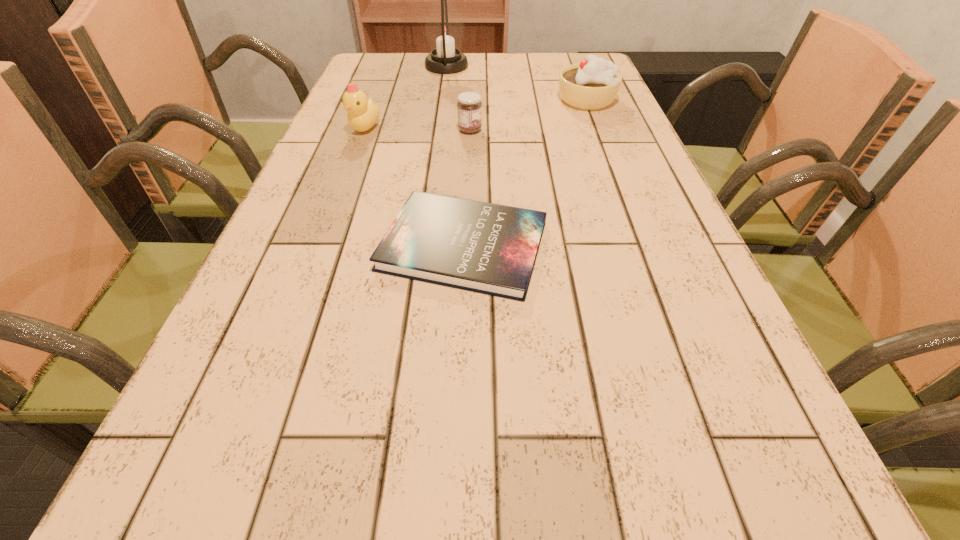
Locate an element on the screen. Image resolution: width=960 pixels, height=540 pixels. vacant region that satisfies the following two spatial constraints: 1. on the back side of the shortest object; 2. on the right side of the rightmost object is located at coordinates (469, 100).

Where is `free region that satisfies the following two spatial constraints: 1. on the front side of the rightmost object; 2. on the front label of the fourth tallest object`? This screenshot has height=540, width=960. free region that satisfies the following two spatial constraints: 1. on the front side of the rightmost object; 2. on the front label of the fourth tallest object is located at coordinates (598, 130).